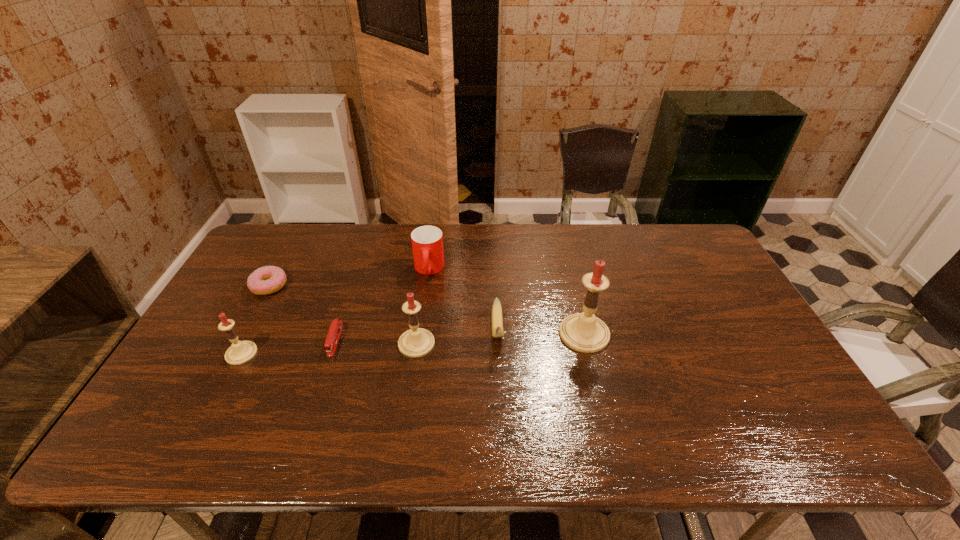
At what (x,y) coordinates should I click in order to perform the action: click on the leftmost candle. Please return your answer as a coordinate pair (x, y). This screenshot has width=960, height=540. Looking at the image, I should click on (240, 352).

I want to click on the second tallest object, so coord(417,342).

Locate an element on the screen. the second candle from right to left is located at coordinates (417, 342).

Image resolution: width=960 pixels, height=540 pixels. I want to click on the tallest candle, so click(583, 332).

At what (x,y) coordinates should I click in order to perform the action: click on the rightmost object. Please return your answer as a coordinate pair (x, y). Looking at the image, I should click on (583, 332).

You are a GUI agent. You are given a task and a screenshot of the screen. Output one action in this format:
    pyautogui.click(x=<x>, y=<y>)
    Task: Click on the fourth tallest object
    Image resolution: width=960 pixels, height=540 pixels.
    Given the screenshot: What is the action you would take?
    pyautogui.click(x=427, y=241)

Locate an element on the screen. The width and height of the screenshot is (960, 540). the third object from left to right is located at coordinates (333, 336).

You are a GUI agent. You are given a task and a screenshot of the screen. Output one action in this format:
    pyautogui.click(x=<x>, y=<y>)
    Task: Click on the doughnut
    
    Given the screenshot: What is the action you would take?
    pyautogui.click(x=266, y=280)

Image resolution: width=960 pixels, height=540 pixels. What are the coordinates of `the fifth tallest object` in the screenshot? It's located at (497, 322).

This screenshot has height=540, width=960. What are the coordinates of `banana` in the screenshot? It's located at (497, 322).